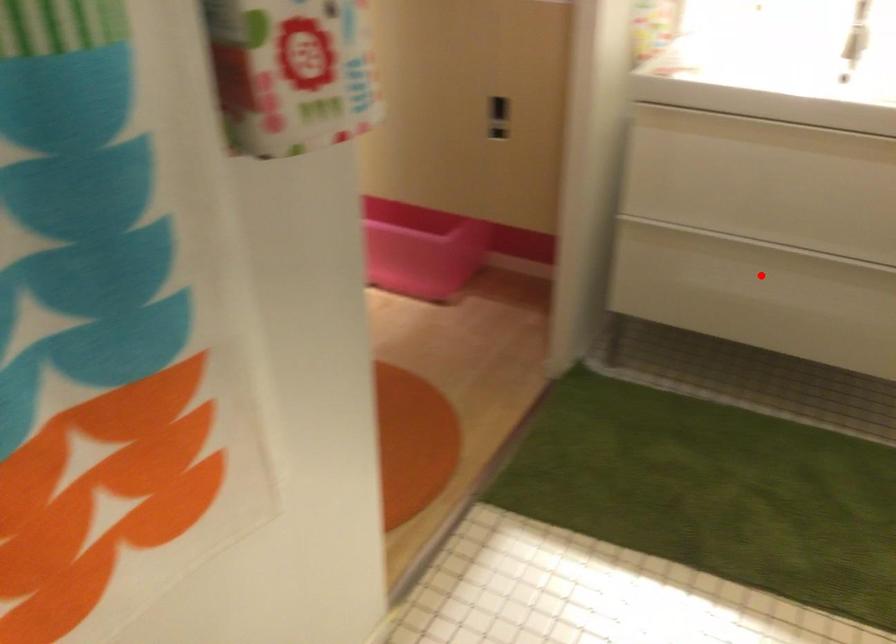
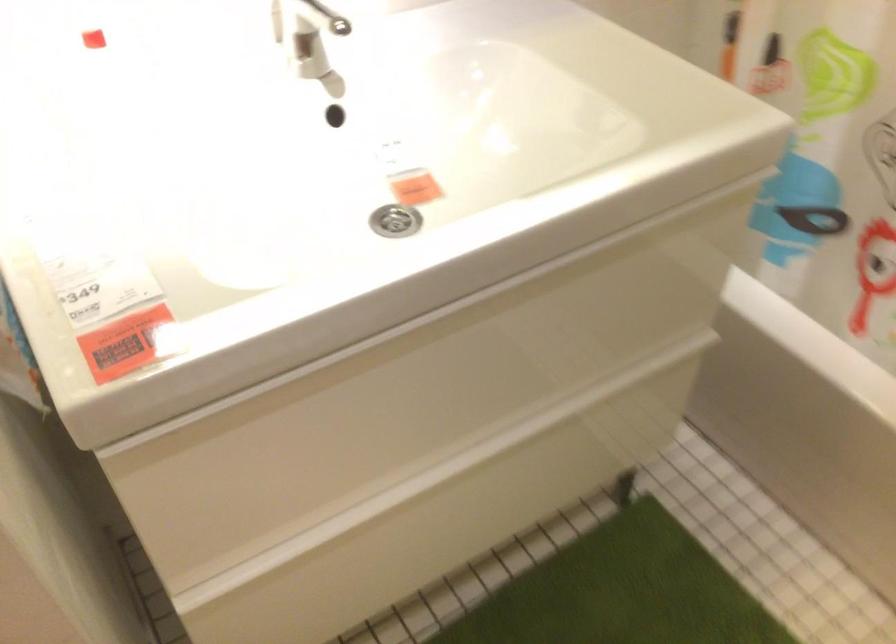
Question: I am providing you with two images of the same scene from different viewpoints. Image1 has a red point marked. In image2, the corresponding 3D location appears at what relative position? Reply with the corresponding letter.

Choices:
 (A) Closer
 (B) Farther

Answer: (A)